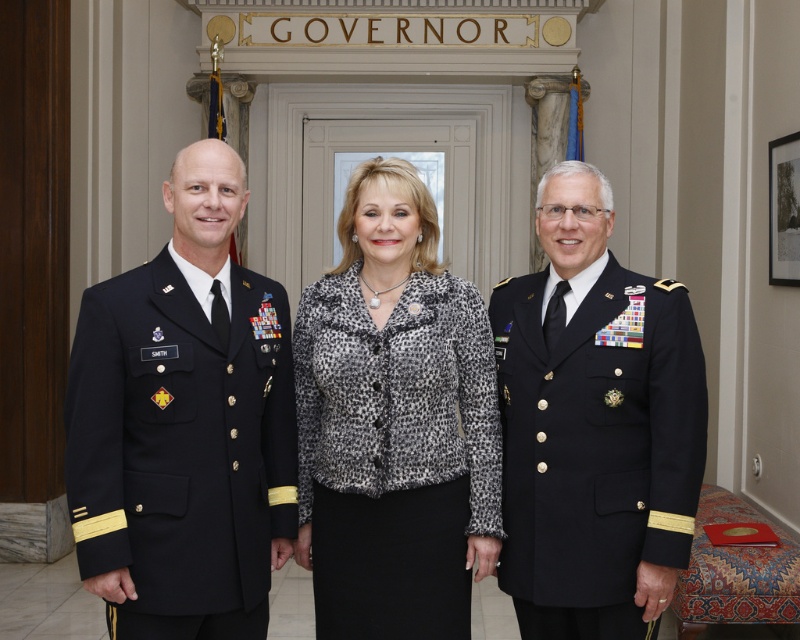
You are standing in front of the scene and want to reach the point marked at coordinates point [324,340]. If your walking distance is limited to 10 feet, can you reach it without moving further?

The point [324,340] is 9.14 feet away from the viewer, so yes, you can reach it within your 10 feet walking limit.

You are a photographer setting up for a group photo. You need to ensure that all subjects are visible within the frame. Given that the leopard print blouse at center takes up more space horizontally than the navy blue fabric military uniform at left, which subject should you position closer to the camera to maintain balance?

The leopard print blouse at center should be positioned closer to the camera because its width is larger than the navy blue fabric military uniform at left, ensuring both subjects appear balanced in the frame.